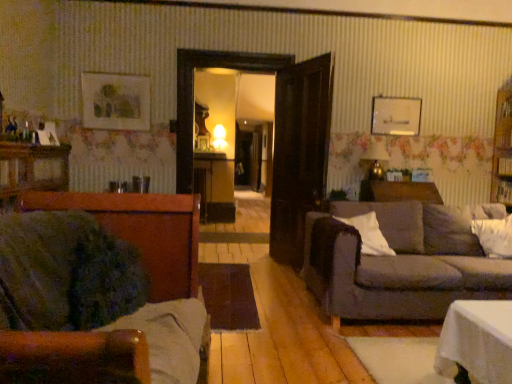
Question: In the image, is white soft pillow at right, placed as the second pillow when sorted from left to right, on the left side or the right side of brown wooden dresser at left?

Choices:
 (A) right
 (B) left

Answer: (A)

Question: In the image, is white soft pillow at right, placed as the second pillow when sorted from left to right, positioned in front of or behind brown wooden dresser at left?

Choices:
 (A) front
 (B) behind

Answer: (B)

Question: Which object is positioned closest to the brown wooden dresser at left?

Choices:
 (A) white soft pillow at right, placed as the second pillow when sorted from left to right
 (B) dark gray fabric couch at right, the second studio couch when ordered from left to right
 (C) velvet green couch at left, which is the 1th studio couch in left-to-right order
 (D) white soft pillow at right, marked as the 1th pillow in a left-to-right arrangement

Answer: (C)

Question: Considering the real-world distances, which object is closest to the white soft pillow at right, placed as the second pillow when sorted from left to right?

Choices:
 (A) dark gray fabric couch at right, which is the 1th studio couch in right-to-left order
 (B) white soft pillow at right, the second pillow in the right-to-left sequence
 (C) brown wooden dresser at left
 (D) velvet green couch at left, which is the second studio couch from right to left

Answer: (A)